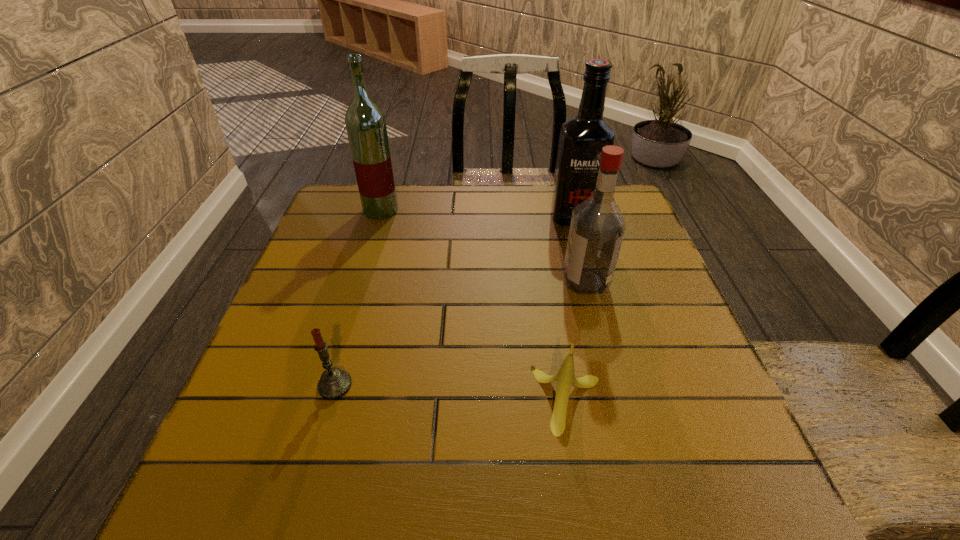
Where is `object that is the fourth closest to the candle`? The width and height of the screenshot is (960, 540). object that is the fourth closest to the candle is located at coordinates (582, 138).

You are a GUI agent. You are given a task and a screenshot of the screen. Output one action in this format:
    pyautogui.click(x=<x>, y=<y>)
    Task: Click on the second closest object relative to the nearest liquor
    The height and width of the screenshot is (540, 960).
    Given the screenshot: What is the action you would take?
    point(565,377)

Where is `liquor that is the second nearest to the nearest liquor`? The height and width of the screenshot is (540, 960). liquor that is the second nearest to the nearest liquor is located at coordinates point(365,122).

Identify which liquor is the nearest to the shortest object. Please provide its 2D coordinates. Your answer should be formatted as a tuple, i.e. [(x, y)], where the tuple contains the x and y coordinates of a point satisfying the conditions above.

[(597, 228)]

Where is `blank space that satisfies the following two spatial constraints: 1. on the front side of the candle; 2. on the right side of the leftmost liquor`? blank space that satisfies the following two spatial constraints: 1. on the front side of the candle; 2. on the right side of the leftmost liquor is located at coordinates tap(328, 386).

Find the location of a particular element. This screenshot has width=960, height=540. blank space that satisfies the following two spatial constraints: 1. on the front-facing side of the nearest liquor; 2. on the front side of the candle is located at coordinates (613, 386).